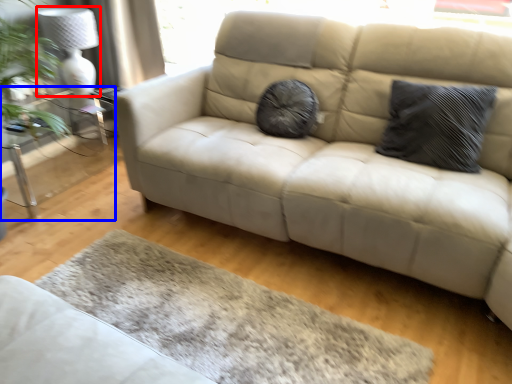
Question: Which of the following is the farthest to the observer, lamp (highlighted by a red box) or table (highlighted by a blue box)?

Choices:
 (A) lamp
 (B) table

Answer: (A)